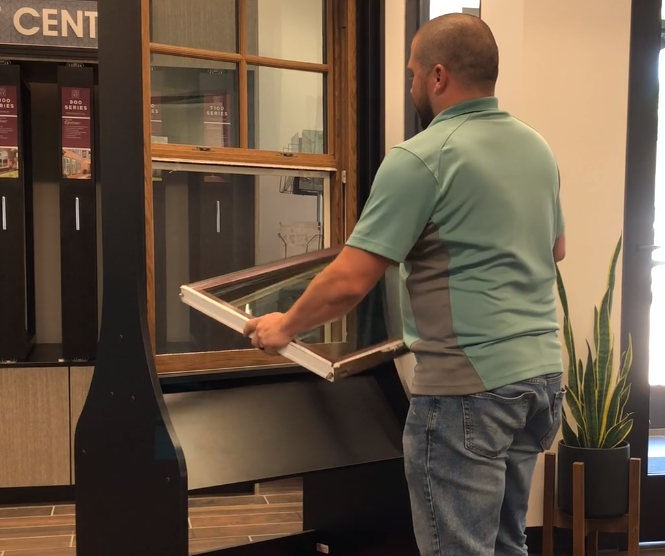
At what (x,y) coordinates should I click in order to perform the action: click on handle. Please return your answer as a coordinate pair (x, y). Image resolution: width=665 pixels, height=556 pixels. Looking at the image, I should click on click(76, 213), click(1, 215), click(217, 216).